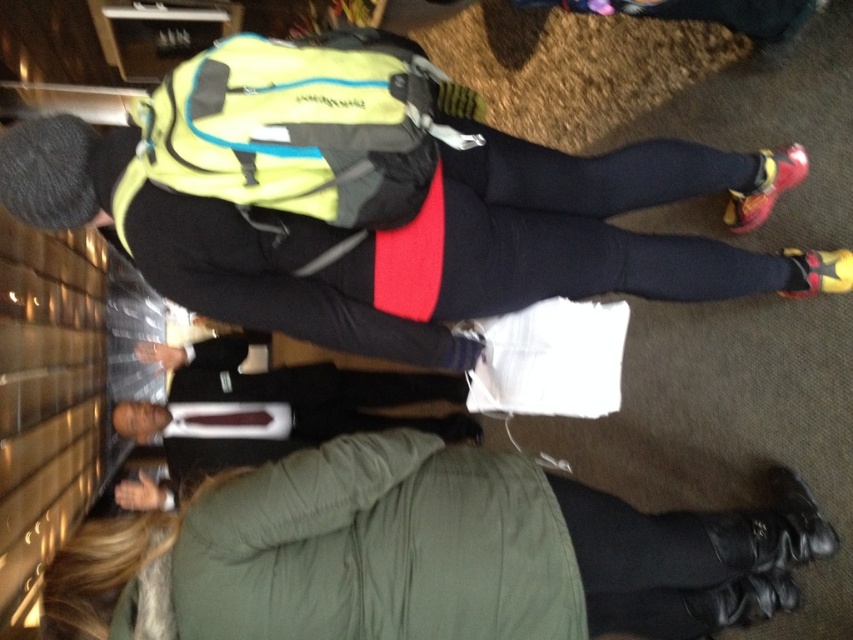
Between green textured coat at lower center and matte black backpack at center, which one has more height?

green textured coat at lower center is taller.

Can you confirm if green textured coat at lower center is bigger than matte black backpack at center?

→ No.

Does point (209, 554) lie behind point (451, 285)?

No.

Locate an element on the screen. This screenshot has height=640, width=853. green textured coat at lower center is located at coordinates (424, 554).